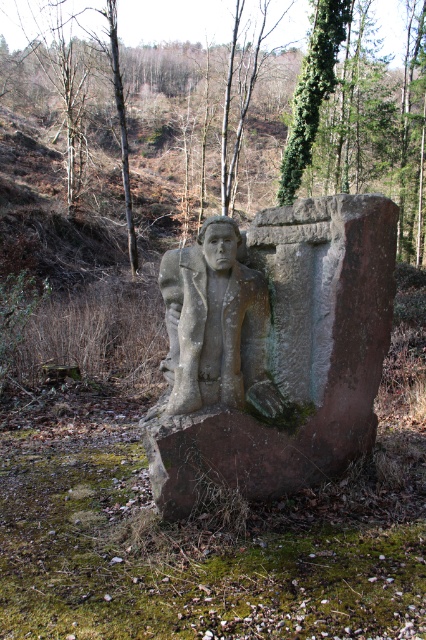
Is stone statue at center to the right of gray stone statue at center from the viewer's perspective?

Yes, stone statue at center is to the right of gray stone statue at center.

Measure the distance between stone statue at center and gray stone statue at center.

stone statue at center is 9.00 inches from gray stone statue at center.

You are a GUI agent. You are given a task and a screenshot of the screen. Output one action in this format:
    pyautogui.click(x=<x>, y=<y>)
    Task: Click on the stone statue at center
    
    Given the screenshot: What is the action you would take?
    pyautogui.click(x=273, y=349)

At what (x,y) coordinates should I click in order to perform the action: click on stone statue at center. Please return your answer as a coordinate pair (x, y). Image resolution: width=426 pixels, height=640 pixels. Looking at the image, I should click on (273, 349).

Which is behind, point (336, 45) or point (357, 276)?

Point (336, 45)

Between green mossy tree at center and stone statue at center, which one is positioned lower?

Positioned lower is stone statue at center.

Which is in front, point (141, 145) or point (287, 413)?

Point (287, 413) is in front.

Where is `green mossy tree at center`? green mossy tree at center is located at coordinates (229, 115).

Is point (416, 116) positioned before point (198, 401)?

No, (416, 116) is further to viewer.

Does point (80, 122) come farther from viewer compared to point (199, 355)?

Yes, point (80, 122) is farther from viewer.

In order to click on green mossy tree at center in this screenshot , I will do `click(229, 115)`.